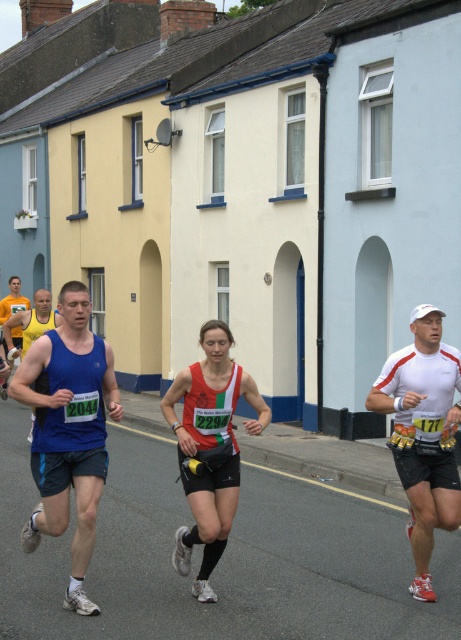
You are a photographer positioned at the starting line of the marathon. You want to capture a photo of both the blue fabric tank top at center and the blue fabric tank top at left. Which runner should you focus on first to ensure both are in frame?

You should focus on the blue fabric tank top at left first because the blue fabric tank top at center is wider, so capturing the narrower blue fabric tank top at left first ensures both will fit within the frame.

You are a photographer capturing the runners in the marathon. You need to ensure that both the blue fabric tank top at center and the red and white running outfit at center are visible in your photo. Given their sizes, which runner should you focus on to ensure both are in frame?

The blue fabric tank top at center is wider than the red and white running outfit at center. To ensure both are in frame, focus on the blue fabric tank top at center since it takes up more space, allowing the narrower red and white running outfit at center to also fit within the photo.